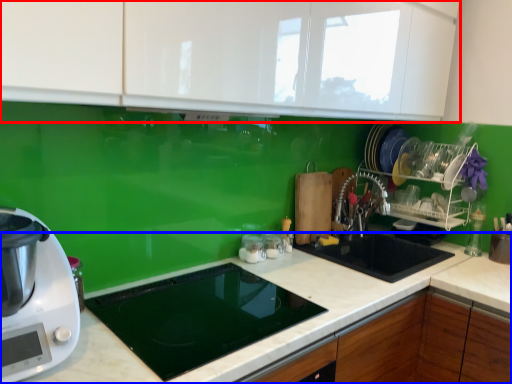
Question: Which object appears farthest to the camera in this image, cabinetry (highlighted by a red box) or countertop (highlighted by a blue box)?

Choices:
 (A) cabinetry
 (B) countertop

Answer: (B)